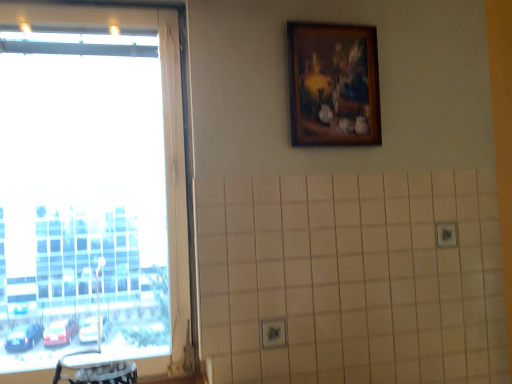
Question: From a real-world perspective, relative to wooden picture frame at upper center, is transparent glass window at left vertically above or below?

Choices:
 (A) below
 (B) above

Answer: (A)

Question: In terms of height, does transparent glass window at left look taller or shorter compared to wooden picture frame at upper center?

Choices:
 (A) short
 (B) tall

Answer: (B)

Question: Looking at their shapes, would you say transparent glass window at left is wider or thinner than wooden picture frame at upper center?

Choices:
 (A) thin
 (B) wide

Answer: (B)

Question: Considering the positions of wooden picture frame at upper center and transparent glass window at left in the image, is wooden picture frame at upper center taller or shorter than transparent glass window at left?

Choices:
 (A) short
 (B) tall

Answer: (A)

Question: Is wooden picture frame at upper center wider or thinner than transparent glass window at left?

Choices:
 (A) thin
 (B) wide

Answer: (A)

Question: In the image, is wooden picture frame at upper center positioned in front of or behind transparent glass window at left?

Choices:
 (A) behind
 (B) front

Answer: (A)

Question: Is point (295, 81) positioned closer to the camera than point (178, 211)?

Choices:
 (A) farther
 (B) closer

Answer: (A)